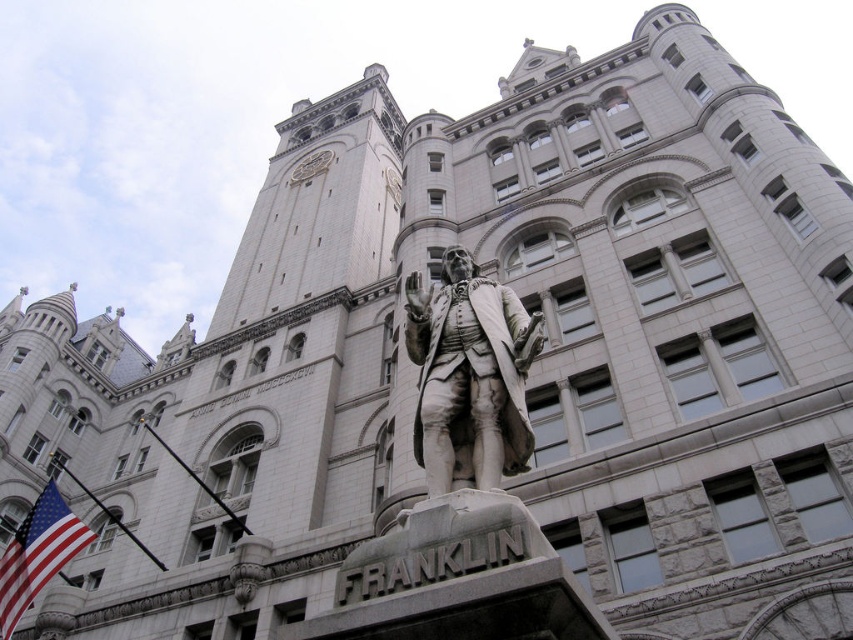
Is white marble statue at center below red fabric flag at lower left?

Incorrect, white marble statue at center is not positioned below red fabric flag at lower left.

Which of these two, white marble statue at center or red fabric flag at lower left, stands taller?

white marble statue at center is taller.

Between point (500, 458) and point (16, 570), which one is positioned in front?

Point (500, 458) is in front.

Where is `white marble statue at center`? The height and width of the screenshot is (640, 853). white marble statue at center is located at coordinates [x=469, y=376].